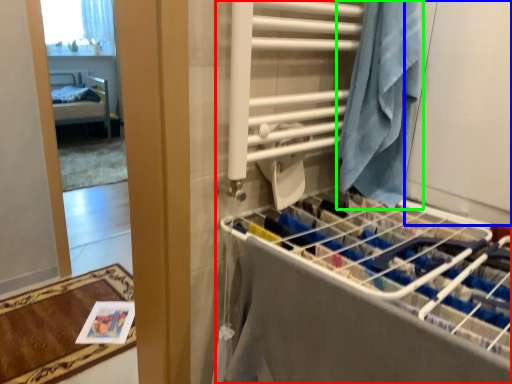
Question: Considering the real-world distances, which object is closest to closet (highlighted by a red box)? screen door (highlighted by a blue box) or beach towel (highlighted by a green box).

Choices:
 (A) screen door
 (B) beach towel

Answer: (B)